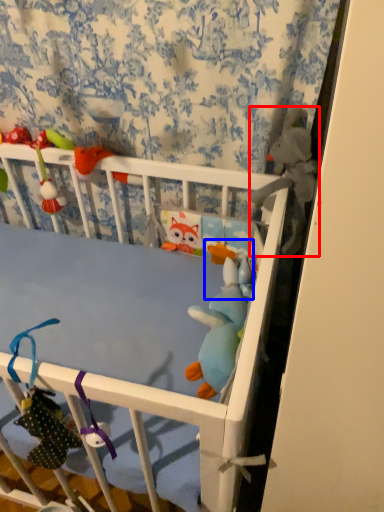
Question: Which point is closer to the camera, toy (highlighted by a red box) or toy (highlighted by a blue box)?

Choices:
 (A) toy
 (B) toy

Answer: (A)